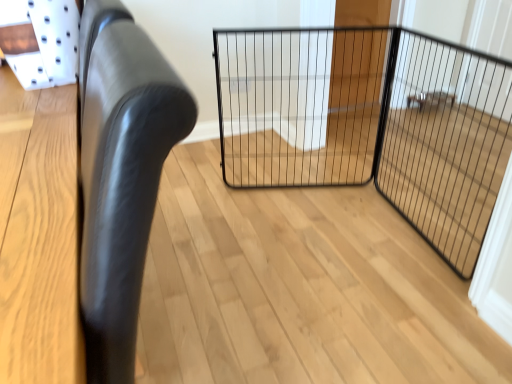
The height and width of the screenshot is (384, 512). Find the location of `vacant space in between black wire mesh screen door at center and black wire mesh gate at center`. vacant space in between black wire mesh screen door at center and black wire mesh gate at center is located at coordinates (360, 227).